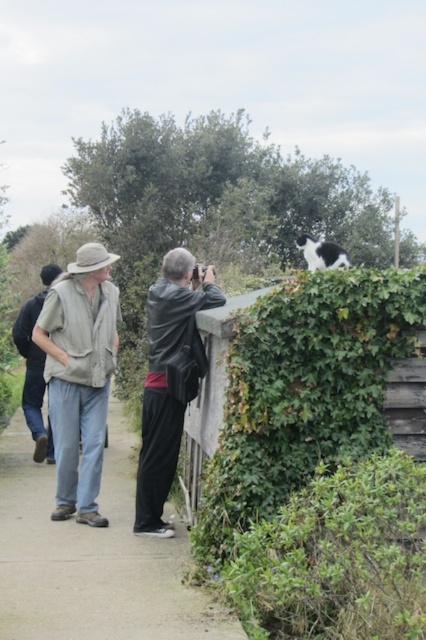
Does green ivy hedge at upper right appear on the left side of black leather jacket at center?

Incorrect, green ivy hedge at upper right is not on the left side of black leather jacket at center.

At what (x,y) coordinates should I click in order to perform the action: click on green ivy hedge at upper right. Please return your answer as a coordinate pair (x, y). Looking at the image, I should click on (317, 465).

In the scene shown: Is concrete sidewalk at lower center to the right of light brown fabric shirt at left from the viewer's perspective?

Indeed, concrete sidewalk at lower center is positioned on the right side of light brown fabric shirt at left.

Is concrete sidewalk at lower center below light brown fabric shirt at left?

Correct, concrete sidewalk at lower center is located below light brown fabric shirt at left.

The height and width of the screenshot is (640, 426). Find the location of `concrete sidewalk at lower center`. concrete sidewalk at lower center is located at coordinates (92, 557).

Locate an element on the screen. concrete sidewalk at lower center is located at coordinates [92, 557].

Consider the image. Is concrete sidewalk at lower center further to camera compared to black leather jacket at center?

No.

Is concrete sidewalk at lower center shorter than black leather jacket at center?

Correct, concrete sidewalk at lower center is not as tall as black leather jacket at center.

Identify the location of concrete sidewalk at lower center. The height and width of the screenshot is (640, 426). click(92, 557).

Image resolution: width=426 pixels, height=640 pixels. Find the location of `concrete sidewalk at lower center`. concrete sidewalk at lower center is located at coordinates (92, 557).